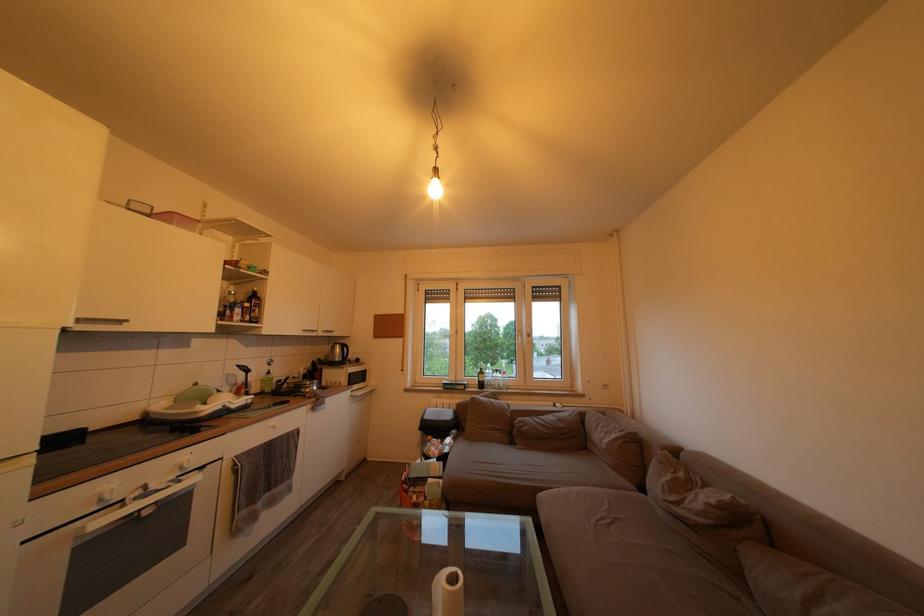
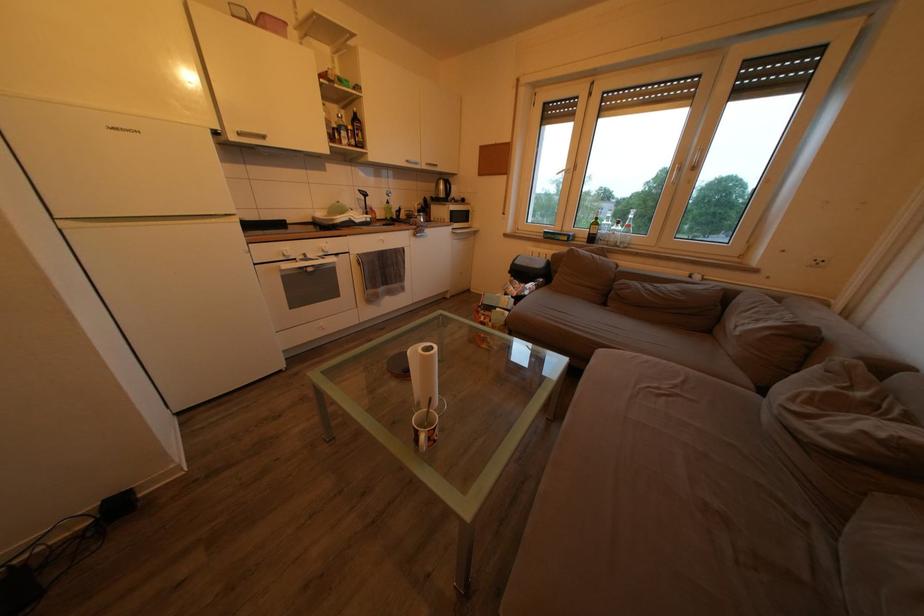
How did the camera likely rotate?

The rotation direction of the camera is left-down.